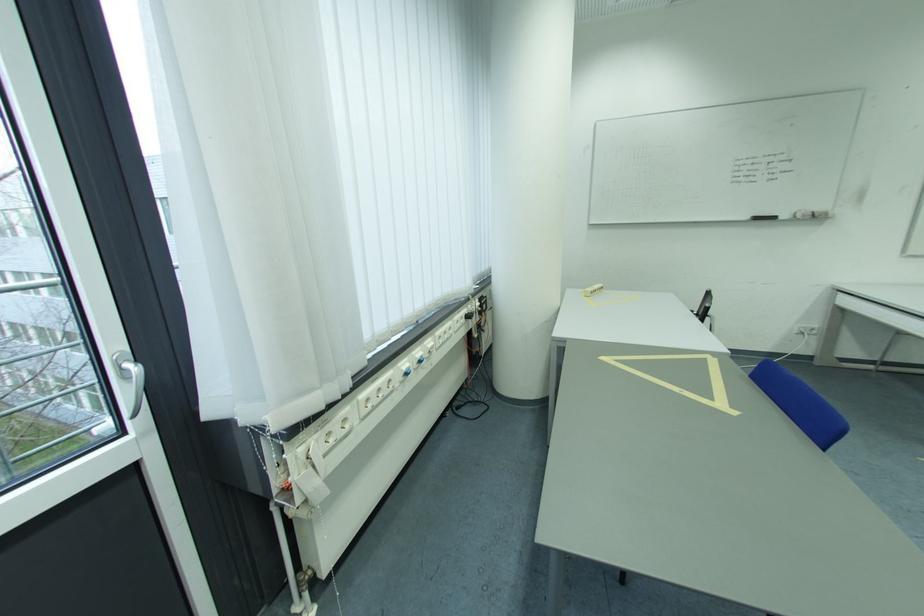
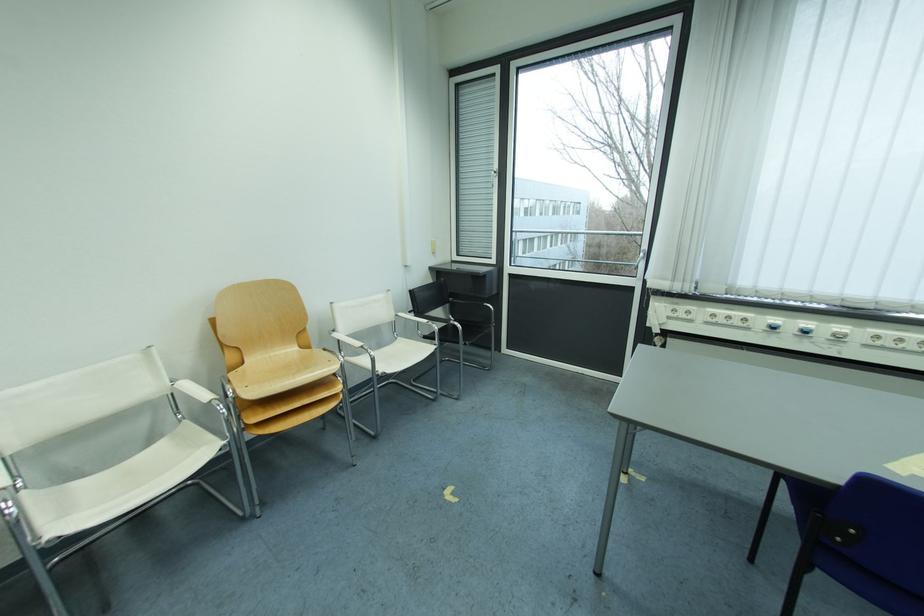
Locate, in the second image, the point that corresponds to point 427,354 in the first image.

(816, 326)